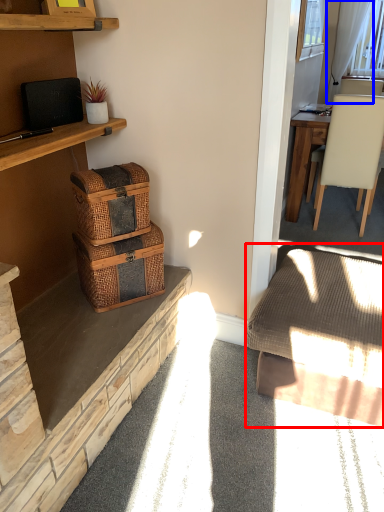
Question: Among these objects, which one is nearest to the camera, studio couch (highlighted by a red box) or curtain (highlighted by a blue box)?

Choices:
 (A) studio couch
 (B) curtain

Answer: (A)